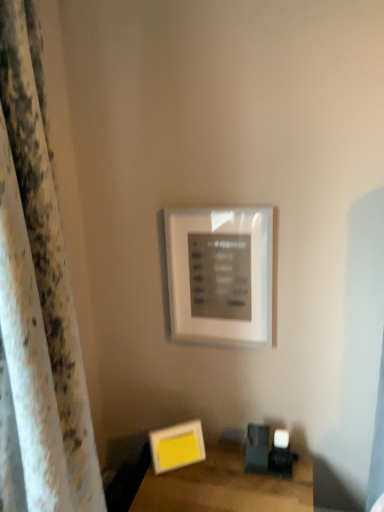
Question: From a real-world perspective, does white textured curtain at left sit lower than wooden table at lower right?

Choices:
 (A) no
 (B) yes

Answer: (A)

Question: Can you confirm if white textured curtain at left is smaller than wooden table at lower right?

Choices:
 (A) yes
 (B) no

Answer: (B)

Question: Could you tell me if white textured curtain at left is facing wooden table at lower right?

Choices:
 (A) no
 (B) yes

Answer: (A)

Question: Does white textured curtain at left appear on the right side of wooden table at lower right?

Choices:
 (A) yes
 (B) no

Answer: (B)

Question: Is white textured curtain at left looking in the opposite direction of wooden table at lower right?

Choices:
 (A) no
 (B) yes

Answer: (A)

Question: From a real-world perspective, is white textured curtain at left located higher than wooden table at lower right?

Choices:
 (A) no
 (B) yes

Answer: (B)

Question: Is yellow matte picture frame at lower center, the 1th picture frame from the bottom, oriented towards wooden table at lower right?

Choices:
 (A) yes
 (B) no

Answer: (B)

Question: From a real-world perspective, is yellow matte picture frame at lower center, marked as the second picture frame in a top-to-bottom arrangement, on top of wooden table at lower right?

Choices:
 (A) yes
 (B) no

Answer: (A)

Question: Can you confirm if yellow matte picture frame at lower center, the 1th picture frame from the bottom, is thinner than wooden table at lower right?

Choices:
 (A) no
 (B) yes

Answer: (B)

Question: Does yellow matte picture frame at lower center, marked as the second picture frame in a top-to-bottom arrangement, lie behind wooden table at lower right?

Choices:
 (A) no
 (B) yes

Answer: (B)

Question: Is the depth of yellow matte picture frame at lower center, marked as the second picture frame in a top-to-bottom arrangement, less than that of wooden table at lower right?

Choices:
 (A) yes
 (B) no

Answer: (B)

Question: Does yellow matte picture frame at lower center, marked as the second picture frame in a top-to-bottom arrangement, have a larger size compared to wooden table at lower right?

Choices:
 (A) yes
 (B) no

Answer: (B)

Question: From a real-world perspective, is yellow matte picture frame at lower center, marked as the second picture frame in a top-to-bottom arrangement, positioned under white matte picture frame at upper center, placed as the first picture frame when sorted from top to bottom, based on gravity?

Choices:
 (A) yes
 (B) no

Answer: (A)